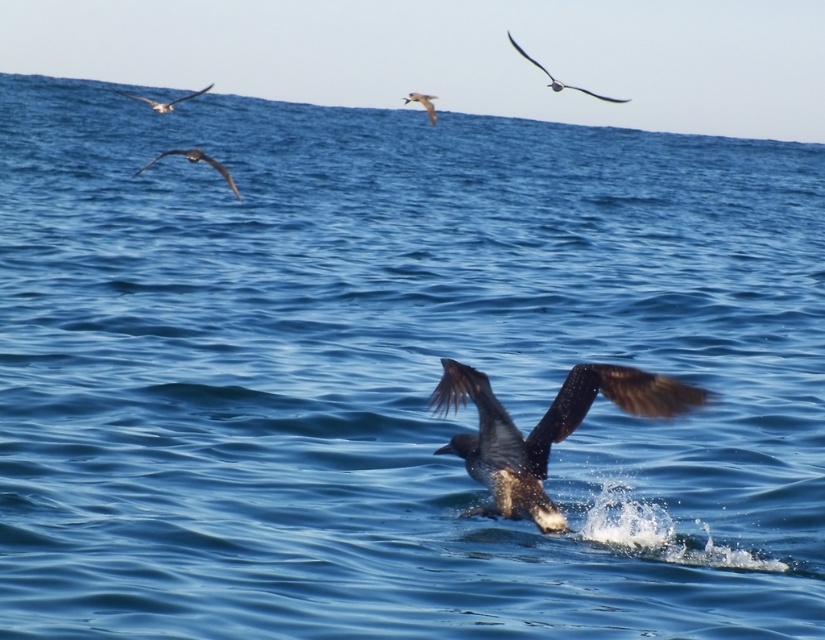
You are a photographer trying to capture both the dark brown feathers at upper left and the white glossy seagull at upper center in a single frame. Based on their sizes, which one should you zoom in on to ensure both fit in the photo?

The dark brown feathers at upper left might be wider than the white glossy seagull at upper center, so you should zoom out to ensure both fit in the photo.

You are a marine biologist observing the seabird in the image. You notice a specific point marked at coordinates [194,163]. What color and location do you observe at this point?

The point at coordinates [194,163] shows dark brown feathers at upper left.

Consider the image. You are a photographer trying to capture the exact spot where the dark brown feathers at upper right were located in the image. What are the coordinates of this location?

The dark brown feathers at upper right are located at coordinates point (559,81).